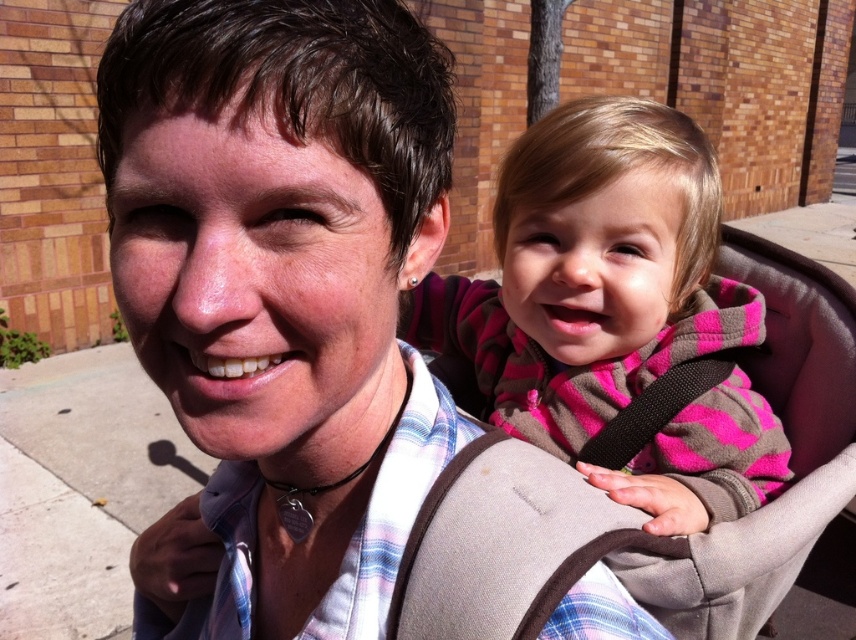
You are a photographer trying to capture a clear photo of the two pink fleece jackets in the image. The jackets are labeled as the pink fleece jacket at upper center and the pink fleece jacket at center. Given that your camera has a minimum focus distance of 0.25 inches, can you focus on both jackets simultaneously?

The pink fleece jacket at upper center and the pink fleece jacket at center are 0.24 inches apart from each other. Since the distance between them is less than the camera minimum focus distance of 0.25 inches, the camera cannot focus on both jackets simultaneously.